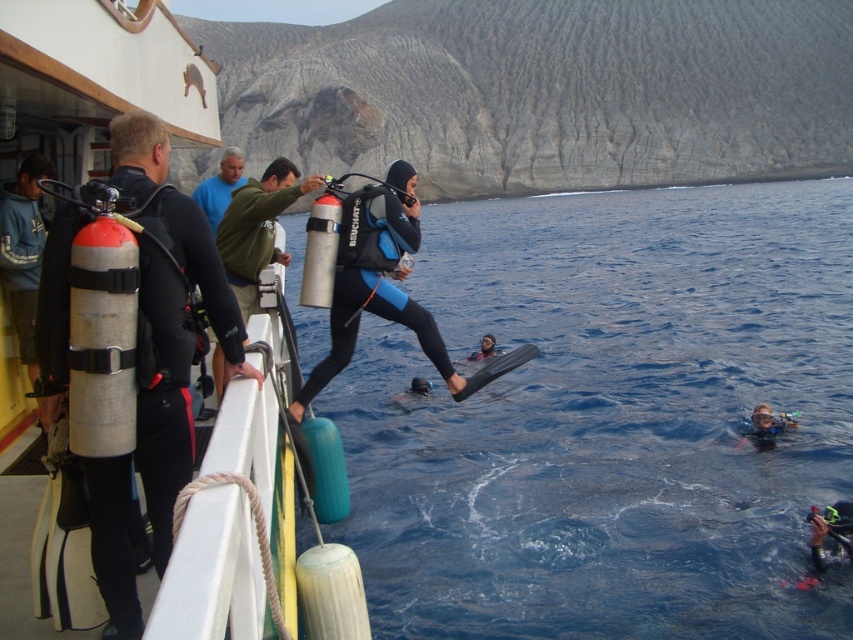
Question: Among these points, which one is nearest to the camera?

Choices:
 (A) (483, 352)
 (B) (207, 118)

Answer: (B)

Question: Which point is farther to the camera?

Choices:
 (A) (492, 339)
 (B) (309, 378)
 (C) (740, 321)
 (D) (154, 109)

Answer: (C)

Question: Is blue water at center smaller than blue matte wetsuit at center?

Choices:
 (A) no
 (B) yes

Answer: (A)

Question: Does blue water at center have a lesser width compared to white matte boat at center?

Choices:
 (A) yes
 (B) no

Answer: (B)

Question: Estimate the real-world distances between objects in this image. Which object is farther from the blue water at center?

Choices:
 (A) black matte wetsuit at center
 (B) white matte boat at center

Answer: (A)

Question: Does blue water at center have a greater width compared to blue matte wetsuit at center?

Choices:
 (A) no
 (B) yes

Answer: (B)